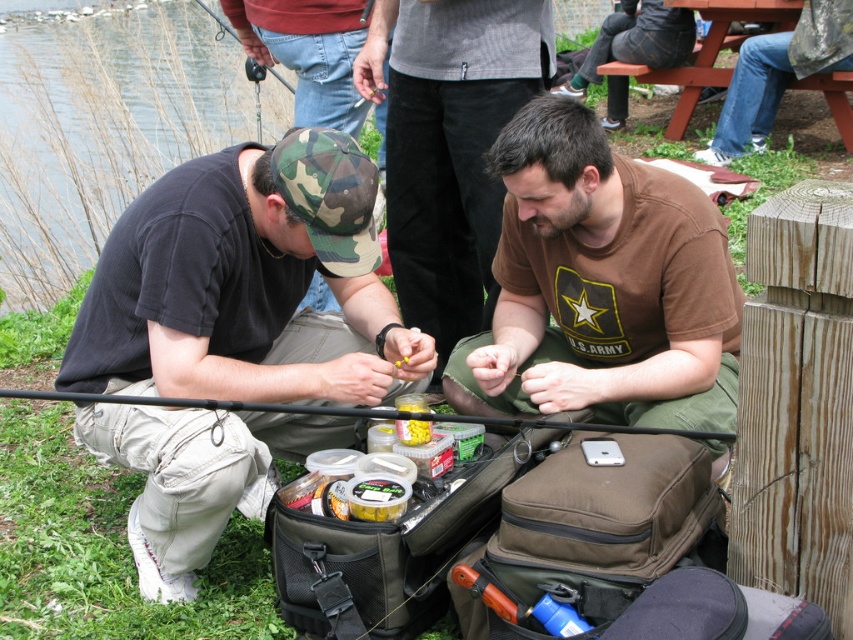
Question: Can you confirm if camo fabric cap at left is positioned to the left of black matte fishing pole at center?

Choices:
 (A) no
 (B) yes

Answer: (B)

Question: Estimate the real-world distances between objects in this image. Which object is closer to the yellow plastic container at center?

Choices:
 (A) camo fabric cap at left
 (B) jeans at lower right
 (C) matte black shirt at center
 (D) black matte fishing pole at center

Answer: (D)

Question: In this image, where is matte black shirt at center located relative to black matte fishing pole at center?

Choices:
 (A) left
 (B) right

Answer: (B)

Question: Among these objects, which one is nearest to the camera?

Choices:
 (A) matte black shirt at center
 (B) camo fabric cap at left
 (C) jeans at lower right
 (D) black matte fishing pole at center

Answer: (D)

Question: Among these objects, which one is farthest from the camera?

Choices:
 (A) yellow plastic container at center
 (B) matte black shirt at center

Answer: (B)

Question: Is brown cotton shirt at center to the left of matte black shirt at center from the viewer's perspective?

Choices:
 (A) yes
 (B) no

Answer: (B)